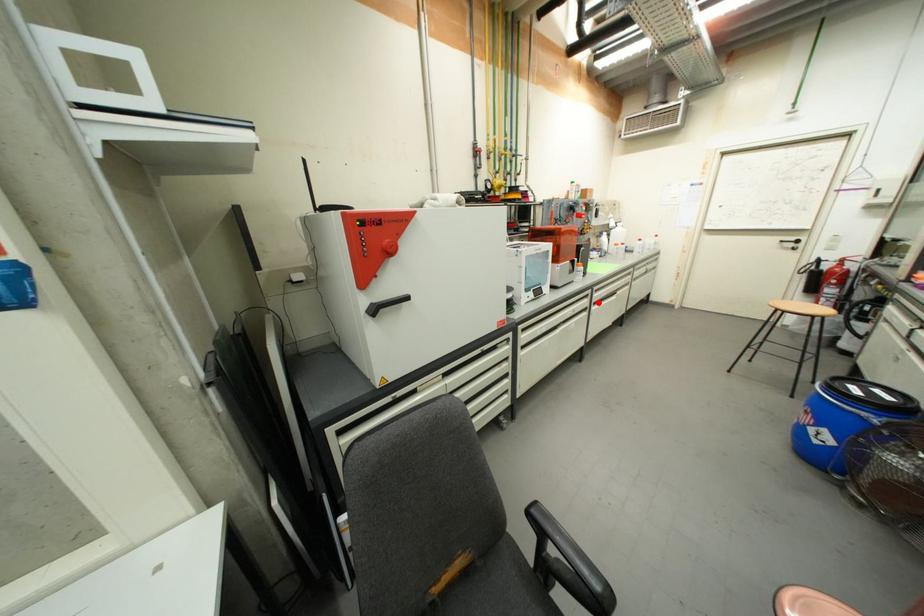
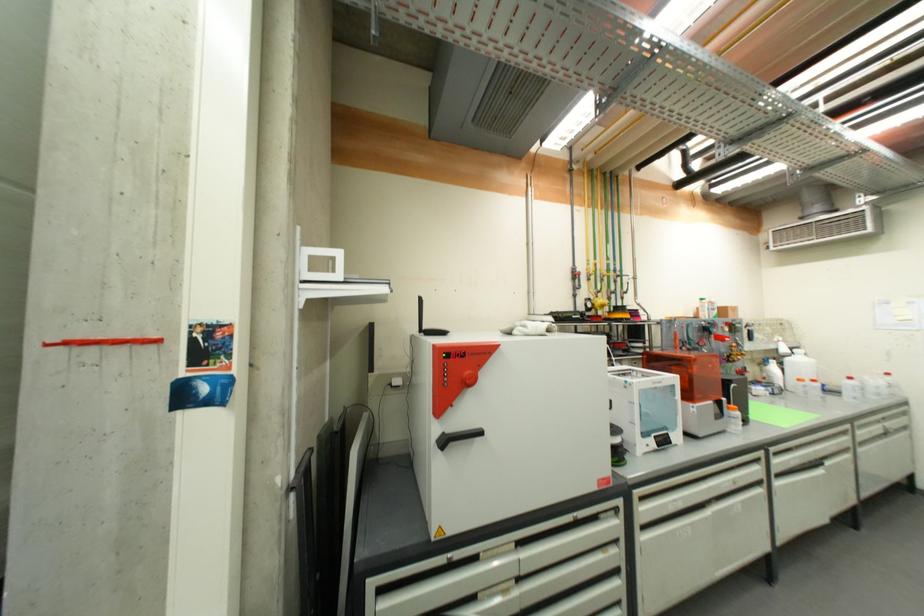
Question: I am providing you with two images of the same scene from different viewpoints. A red point is shown in image1. For the corresponding object point in image2, is it positioned nearer or farther from the camera?

Choices:
 (A) Nearer
 (B) Farther

Answer: (A)